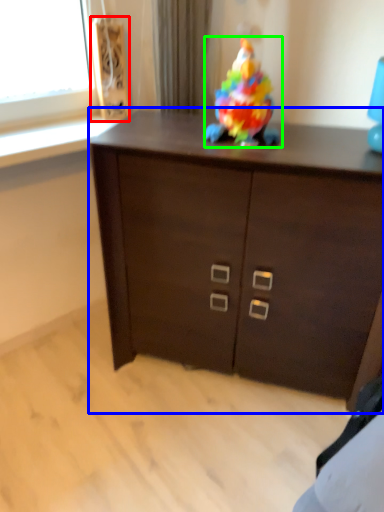
Question: Considering the real-world distances, which object is closest to speaker (highlighted by a red box)? chest of drawers (highlighted by a blue box) or toy (highlighted by a green box).

Choices:
 (A) chest of drawers
 (B) toy

Answer: (B)